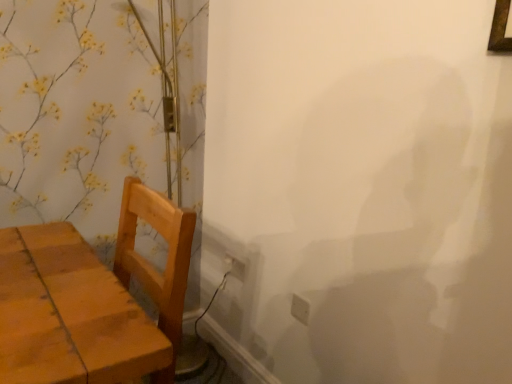
Question: Is white plastic electric outlet at lower right, the 1th electric outlet when ordered from bottom to top, beside white plastic electric outlet at lower center, arranged as the first electric outlet when viewed from the left?

Choices:
 (A) no
 (B) yes

Answer: (A)

Question: Is white plastic electric outlet at lower center, which is the 1th electric outlet from top to bottom, surrounded by white plastic electric outlet at lower right, the 1th electric outlet when ordered from bottom to top?

Choices:
 (A) yes
 (B) no

Answer: (B)

Question: Considering the relative sizes of white plastic electric outlet at lower right, the 1th electric outlet when ordered from bottom to top, and white plastic electric outlet at lower center, arranged as the 2th electric outlet when ordered from the bottom, in the image provided, is white plastic electric outlet at lower right, the 1th electric outlet when ordered from bottom to top, shorter than white plastic electric outlet at lower center, arranged as the 2th electric outlet when ordered from the bottom,?

Choices:
 (A) yes
 (B) no

Answer: (B)

Question: Is white plastic electric outlet at lower right, arranged as the first electric outlet when viewed from the front, smaller than white plastic electric outlet at lower center, positioned as the 1th electric outlet in back-to-front order?

Choices:
 (A) yes
 (B) no

Answer: (A)

Question: Is white plastic electric outlet at lower right, which is counted as the 1th electric outlet, starting from the right, facing towards white plastic electric outlet at lower center, which is the 1th electric outlet from top to bottom?

Choices:
 (A) yes
 (B) no

Answer: (B)

Question: Is wooden table at left situated inside white plastic electric outlet at lower right, arranged as the first electric outlet when viewed from the front, or outside?

Choices:
 (A) inside
 (B) outside

Answer: (B)

Question: In terms of size, does wooden table at left appear bigger or smaller than white plastic electric outlet at lower right, which is counted as the 1th electric outlet, starting from the right?

Choices:
 (A) small
 (B) big

Answer: (B)

Question: Considering the positions of wooden table at left and white plastic electric outlet at lower right, arranged as the first electric outlet when viewed from the front, in the image, is wooden table at left wider or thinner than white plastic electric outlet at lower right, arranged as the first electric outlet when viewed from the front,?

Choices:
 (A) wide
 (B) thin

Answer: (A)

Question: In the image, is wooden table at left positioned in front of or behind white plastic electric outlet at lower right, arranged as the first electric outlet when viewed from the front?

Choices:
 (A) behind
 (B) front

Answer: (B)

Question: From a real-world perspective, relative to wooden table at left, is white plastic electric outlet at lower right, which is counted as the 1th electric outlet, starting from the right, vertically above or below?

Choices:
 (A) above
 (B) below

Answer: (B)

Question: In terms of height, does white plastic electric outlet at lower right, the 2th electric outlet positioned from the top, look taller or shorter compared to wooden table at left?

Choices:
 (A) tall
 (B) short

Answer: (B)

Question: Is point (301, 307) closer or farther from the camera than point (101, 321)?

Choices:
 (A) closer
 (B) farther

Answer: (B)

Question: Choose the correct answer: Is white plastic electric outlet at lower right, the 1th electric outlet when ordered from bottom to top, inside wooden table at left or outside it?

Choices:
 (A) outside
 (B) inside

Answer: (A)

Question: From the image's perspective, is white plastic electric outlet at lower center, which is the 1th electric outlet from top to bottom, located above or below white plastic electric outlet at lower right, the 2th electric outlet when ordered from left to right?

Choices:
 (A) below
 (B) above

Answer: (B)

Question: Choose the correct answer: Is white plastic electric outlet at lower center, which is the 1th electric outlet from top to bottom, inside white plastic electric outlet at lower right, arranged as the first electric outlet when viewed from the front, or outside it?

Choices:
 (A) outside
 (B) inside

Answer: (A)